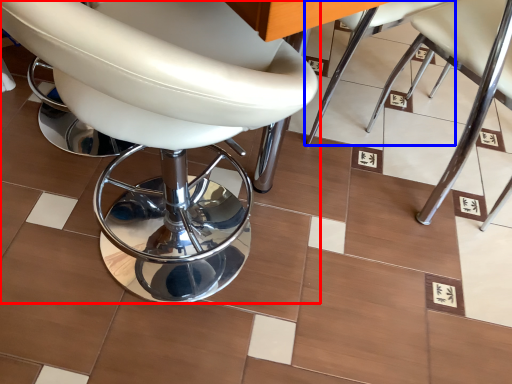
Question: Which object is further to the camera taking this photo, chair (highlighted by a red box) or chair (highlighted by a blue box)?

Choices:
 (A) chair
 (B) chair

Answer: (B)